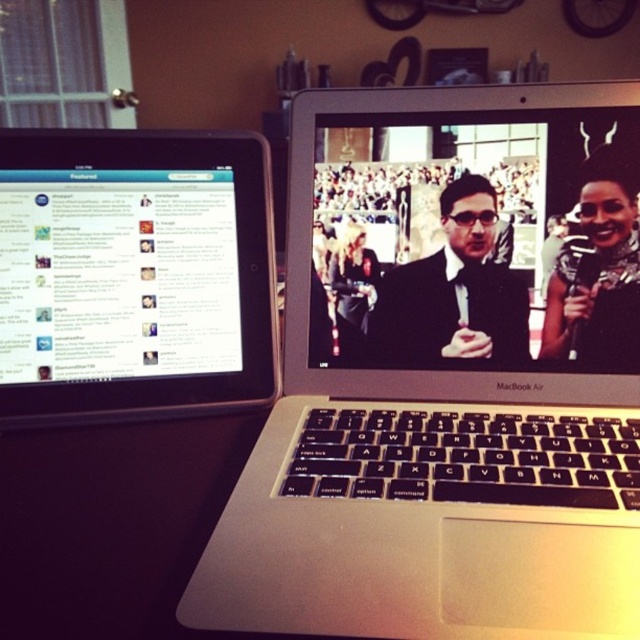
You are holding a 10 inch wide book and want to place it on the silver metallic laptop at center. Can the book fit on the laptop without hanging over the edges?

The silver metallic laptop at center and viewer are 11.40 inches apart from each other. However, this distance does not indicate the laptop screen size. The question about the book fitting on the laptop cannot be answered accurately with the provided information.

You are organizing a tech exhibition and need to place a label next to the silver metallic laptop at center. According to the coordinates provided, where should you position the label relative to the laptop?

The silver metallic laptop at center is located at point (449, 376), so the label should be positioned to the right of the laptop to ensure visibility and proper alignment.

You are organizing a tech conference and need to place a satin black laptop at center and a black glossy microphone at right on a table. The table has limited space. Which object will require more space due to its size?

The satin black laptop at center requires more space because it is bigger than the black glossy microphone at right.